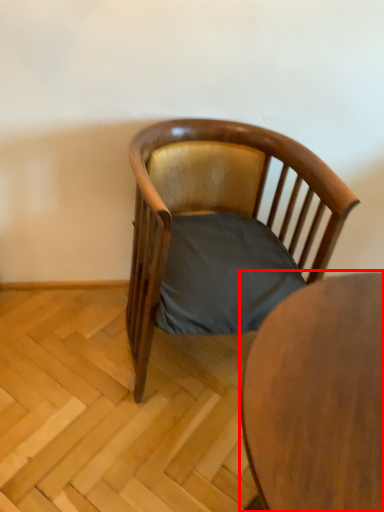
Question: From the image, what is the correct spatial relationship of table (annotated by the red box) in relation to chair?

Choices:
 (A) right
 (B) left

Answer: (A)